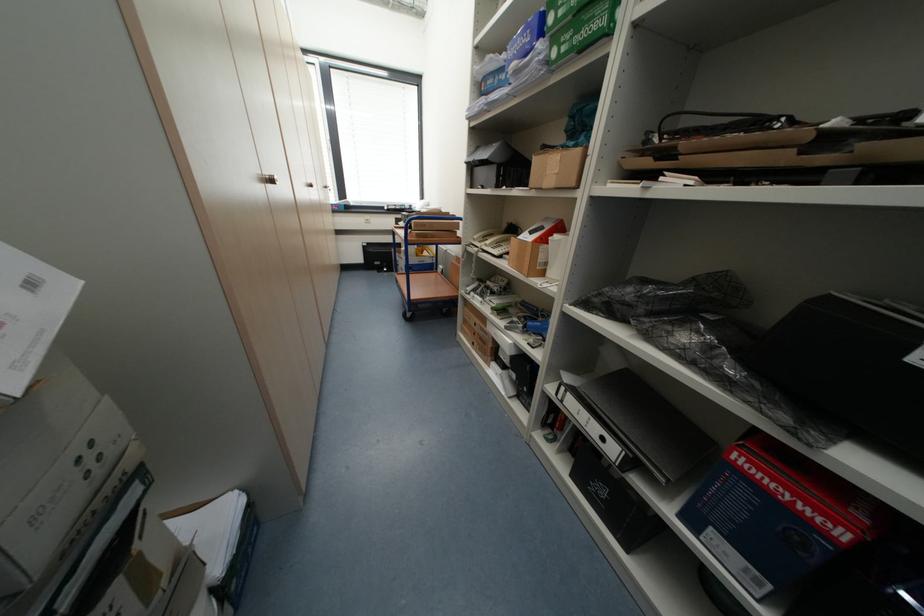
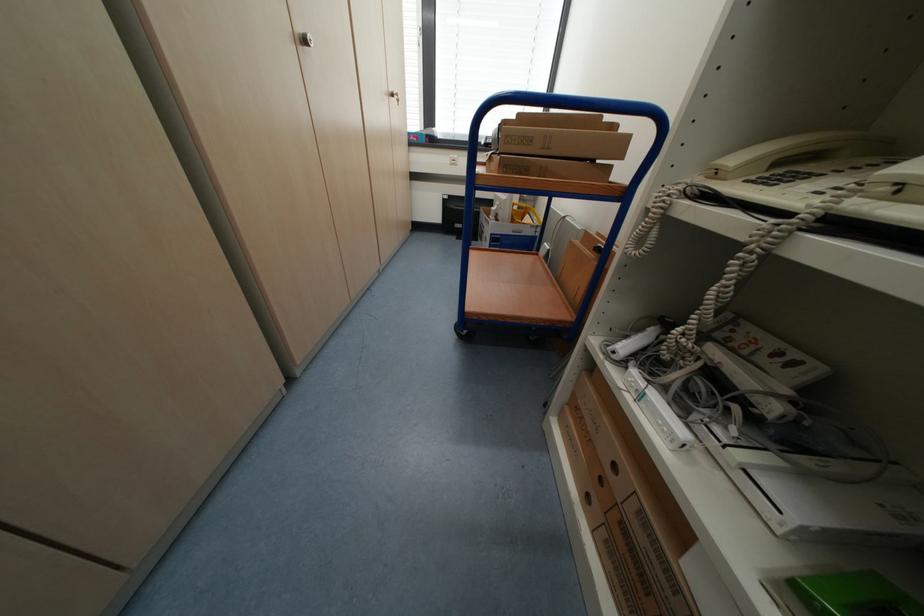
Locate, in the second image, the point that corresponds to pixel 482 238 in the first image.

(739, 161)